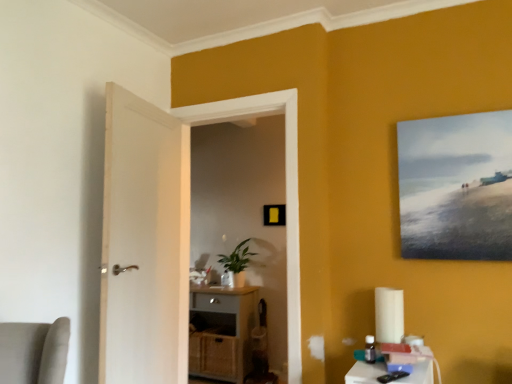
Question: Is white plastic table at lower right bigger or smaller than green matte plant at center?

Choices:
 (A) small
 (B) big

Answer: (A)

Question: Considering the positions of white plastic table at lower right and green matte plant at center in the image, is white plastic table at lower right taller or shorter than green matte plant at center?

Choices:
 (A) short
 (B) tall

Answer: (A)

Question: Estimate the real-world distances between objects in this image. Which object is farther from the matte gray cabinet at center?

Choices:
 (A) white plastic table at lower right
 (B) matte black picture frame at center, which appears as the 1th picture frame when viewed from the left
 (C) matte white door at center
 (D) green matte plant at center
 (E) matte canvas painting at upper right, the second picture frame viewed from the left

Answer: (E)

Question: Estimate the real-world distances between objects in this image. Which object is closer to the matte black picture frame at center, which appears as the 1th picture frame when viewed from the left?

Choices:
 (A) matte white door at center
 (B) matte gray cabinet at center
 (C) green matte plant at center
 (D) matte canvas painting at upper right, placed as the 1th picture frame when sorted from front to back
 (E) white plastic table at lower right

Answer: (C)